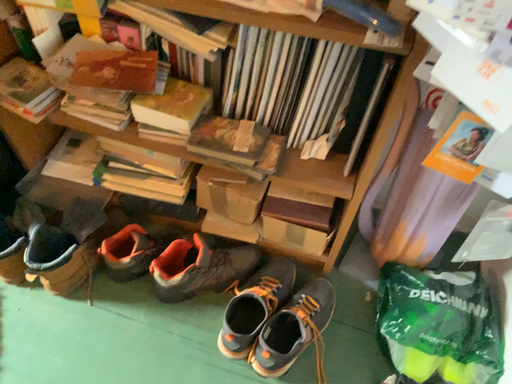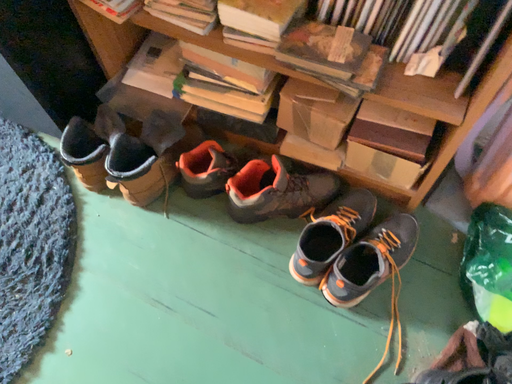
Question: How did the camera likely rotate when shooting the video?

Choices:
 (A) rotated downward
 (B) rotated upward

Answer: (A)